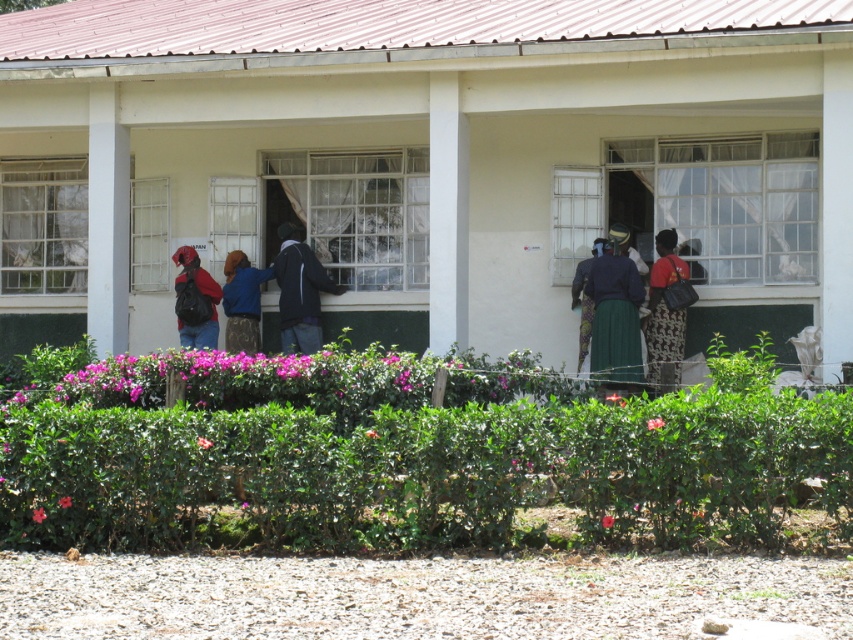
Describe the element at coordinates (299, 291) in the screenshot. Image resolution: width=853 pixels, height=640 pixels. I see `dark blue jacket at center` at that location.

Is point (289, 321) positioned in front of point (201, 346)?

Yes, point (289, 321) is closer to viewer.

Identify the location of dark blue jacket at center. (299, 291).

Is matte black backpack at left bigger than blue fabric jacket at center?

Indeed, matte black backpack at left has a larger size compared to blue fabric jacket at center.

Does matte black backpack at left appear over blue fabric jacket at center?

Yes.

The height and width of the screenshot is (640, 853). Find the location of `matte black backpack at left`. matte black backpack at left is located at coordinates (195, 300).

Is red fabric dress at center below green textured skirt at center?

Yes, red fabric dress at center is below green textured skirt at center.

Is red fabric dress at center taller than green textured skirt at center?

Correct, red fabric dress at center is much taller as green textured skirt at center.

Is point (664, 230) positioned behind point (572, 300)?

No, it is in front of (572, 300).

This screenshot has width=853, height=640. What are the coordinates of `red fabric dress at center` in the screenshot? It's located at (664, 314).